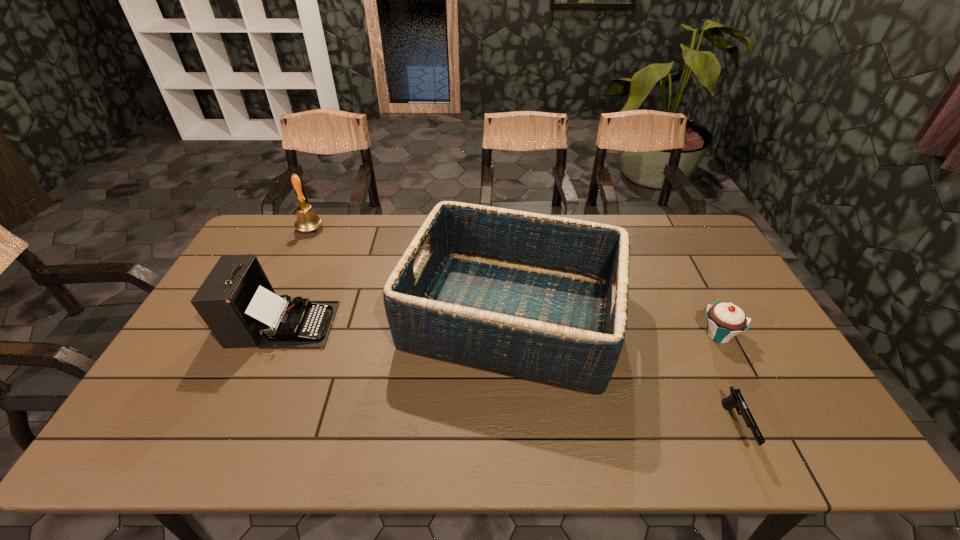
In order to click on vacant space at the right edge of the desktop in this screenshot , I will do `click(708, 273)`.

This screenshot has width=960, height=540. I want to click on free space at the far left corner, so click(x=266, y=226).

This screenshot has height=540, width=960. In order to click on vacant region at the near left corner of the desktop in this screenshot , I will do `click(171, 427)`.

At what (x,y) coordinates should I click in order to perform the action: click on free space at the far right corner. Please return your answer as a coordinate pair (x, y). This screenshot has height=540, width=960. Looking at the image, I should click on (683, 254).

Identify the location of empty location between the basket and the second object from right to left. The image size is (960, 540). (623, 372).

Choose which object is the second nearest neighbor to the gun. Please provide its 2D coordinates. Your answer should be formatted as a tuple, i.e. [(x, y)], where the tuple contains the x and y coordinates of a point satisfying the conditions above.

[(544, 298)]

Locate an element on the screen. Image resolution: width=960 pixels, height=540 pixels. the closest object relative to the farthest object is located at coordinates (237, 302).

Locate an element on the screen. The image size is (960, 540). vacant space that satisfies the following two spatial constraints: 1. inside the open case of the typewriter; 2. on the left side of the rightmost object is located at coordinates pyautogui.click(x=278, y=334).

The image size is (960, 540). Find the location of `free location that satisfies the following two spatial constraints: 1. inside the open case of the typewriter; 2. on the back side of the cupcake`. free location that satisfies the following two spatial constraints: 1. inside the open case of the typewriter; 2. on the back side of the cupcake is located at coordinates (278, 334).